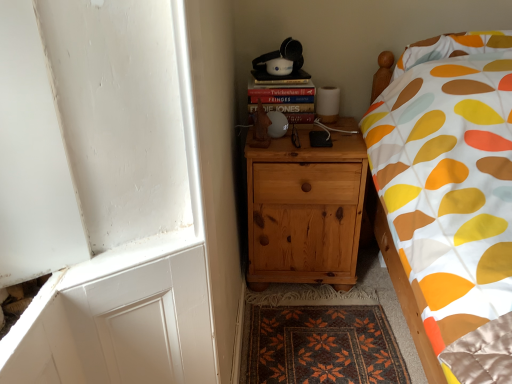
Identify the location of wooden statue at center. Image resolution: width=512 pixels, height=384 pixels. (260, 128).

Where is `hardcover book at upper right`? hardcover book at upper right is located at coordinates (285, 100).

Is wooden statue at center positioned with its back to natural wood nightstand at center?

No, wooden statue at center is not facing the opposite direction of natural wood nightstand at center.

Between wooden statue at center and natural wood nightstand at center, which one has more height?

natural wood nightstand at center.

Are wooden statue at center and natural wood nightstand at center making contact?

No, wooden statue at center is not in contact with natural wood nightstand at center.

From the image's perspective, between wooden statue at center and natural wood nightstand at center, who is located below?

natural wood nightstand at center, from the image's perspective.

In the scene shown: Can you confirm if natural wood nightstand at center is wider than wooden statue at center?

Indeed, natural wood nightstand at center has a greater width compared to wooden statue at center.

Would you consider natural wood nightstand at center to be distant from wooden statue at center?

Actually, natural wood nightstand at center and wooden statue at center are a little close together.

Is natural wood nightstand at center oriented away from wooden statue at center?

No, natural wood nightstand at center is not facing the opposite direction of wooden statue at center.

Considering the relative sizes of natural wood nightstand at center and wooden statue at center in the image provided, is natural wood nightstand at center shorter than wooden statue at center?

Incorrect, the height of natural wood nightstand at center does not fall short of that of wooden statue at center.

From the image's perspective, is dark brown woven mat at lower center below hardcover book at upper right?

Indeed, from the image's perspective, dark brown woven mat at lower center is shown beneath hardcover book at upper right.

The height and width of the screenshot is (384, 512). What are the coordinates of `book positioned vertically above the dark brown woven mat at lower center (from a real-world perspective)` in the screenshot? It's located at (285, 100).

Is dark brown woven mat at lower center to the left of hardcover book at upper right from the viewer's perspective?

No.

Does dark brown woven mat at lower center touch hardcover book at upper right?

dark brown woven mat at lower center and hardcover book at upper right are clearly separated.

Is natural wood nightstand at center located within dark brown woven mat at lower center?

Definitely not — natural wood nightstand at center is not inside dark brown woven mat at lower center.

Which of these two, dark brown woven mat at lower center or natural wood nightstand at center, stands taller?

natural wood nightstand at center is taller.

Is dark brown woven mat at lower center next to natural wood nightstand at center?

No.

Is natural wood nightstand at center facing towards hardcover book at upper right?

No.

Can you confirm if natural wood nightstand at center is bigger than hardcover book at upper right?

Yes, natural wood nightstand at center is bigger than hardcover book at upper right.

Choose the correct answer: Is natural wood nightstand at center inside hardcover book at upper right or outside it?

The correct answer is: outside.

From a real-world perspective, between natural wood nightstand at center and hardcover book at upper right, who is vertically higher?

From a 3D spatial view, hardcover book at upper right is above.

Consider the image. From a real-world perspective, between hardcover book at upper right and wooden statue at center, who is vertically higher?

From a 3D spatial view, wooden statue at center is above.

Between hardcover book at upper right and wooden statue at center, which one has more height?

Standing taller between the two is hardcover book at upper right.

Is hardcover book at upper right turned away from wooden statue at center?

That's not correct — hardcover book at upper right is not looking away from wooden statue at center.

Can you see hardcover book at upper right touching wooden statue at center?

hardcover book at upper right and wooden statue at center are not in contact.

Which object is more forward, wooden statue at center or hardcover book at upper right?

wooden statue at center is closer to the camera.

Between point (267, 126) and point (251, 100), which one is positioned in front?

The point (267, 126) is closer to the camera.

How far apart are wooden statue at center and hardcover book at upper right?

They are 5.15 inches apart.

Identify the location of toy lying on the left of natural wood nightstand at center. This screenshot has height=384, width=512. (260, 128).

The image size is (512, 384). What are the coordinates of `cabinetry on the right side of wooden statue at center` in the screenshot? It's located at (305, 210).

Estimate the real-world distances between objects in this image. Which object is closer to wooden statue at center, dark brown woven mat at lower center or natural wood nightstand at center?

Based on the image, natural wood nightstand at center appears to be nearer to wooden statue at center.

Consider the image. Looking at the image, which one is located further to dark brown woven mat at lower center, wooden statue at center or natural wood nightstand at center?

wooden statue at center is further to dark brown woven mat at lower center.

Looking at the image, which one is located closer to dark brown woven mat at lower center, natural wood nightstand at center or hardcover book at upper right?

natural wood nightstand at center lies closer to dark brown woven mat at lower center than the other object.

Considering their positions, is wooden statue at center positioned further to natural wood nightstand at center than dark brown woven mat at lower center?

Based on the image, dark brown woven mat at lower center appears to be further to natural wood nightstand at center.

Considering their positions, is natural wood nightstand at center positioned further to hardcover book at upper right than wooden statue at center?

The object further to hardcover book at upper right is natural wood nightstand at center.

Which object lies further to the anchor point dark brown woven mat at lower center, wooden statue at center or hardcover book at upper right?

The object further to dark brown woven mat at lower center is hardcover book at upper right.

When comparing their distances from wooden statue at center, does natural wood nightstand at center or hardcover book at upper right seem further?

natural wood nightstand at center lies further to wooden statue at center than the other object.

From the picture: Considering their positions, is hardcover book at upper right positioned further to natural wood nightstand at center than dark brown woven mat at lower center?

dark brown woven mat at lower center lies further to natural wood nightstand at center than the other object.

The height and width of the screenshot is (384, 512). Find the location of `cabinetry between hardcover book at upper right and dark brown woven mat at lower center from top to bottom`. cabinetry between hardcover book at upper right and dark brown woven mat at lower center from top to bottom is located at coordinates (305, 210).

Find the location of a particular element. The width and height of the screenshot is (512, 384). toy between hardcover book at upper right and dark brown woven mat at lower center vertically is located at coordinates (260, 128).

Locate an element on the screen. toy between hardcover book at upper right and natural wood nightstand at center vertically is located at coordinates (260, 128).

Identify the location of cabinetry that lies between wooden statue at center and dark brown woven mat at lower center from top to bottom. (305, 210).